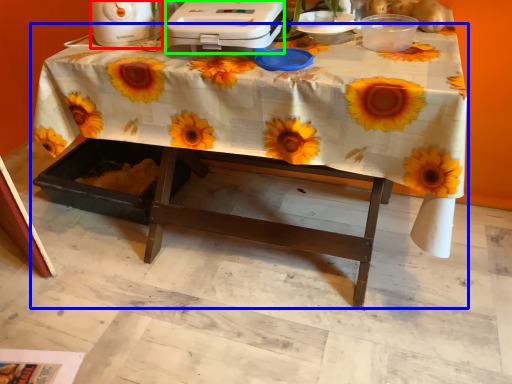
Question: Estimate the real-world distances between objects in this image. Which object is closer to appliance (highlighted by a red box), table (highlighted by a blue box) or appliance (highlighted by a green box)?

Choices:
 (A) table
 (B) appliance

Answer: (B)